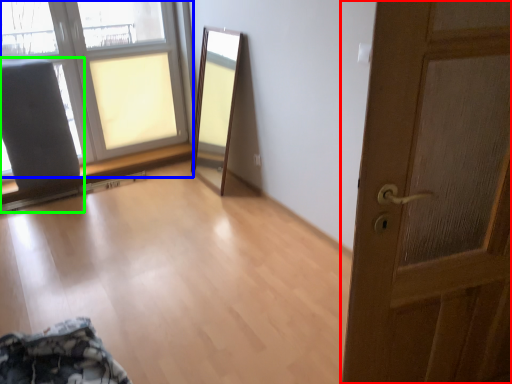
Question: Based on their relative distances, which object is nearer to door (highlighted by a red box)? Choose from window (highlighted by a blue box) and armchair (highlighted by a green box).

Choices:
 (A) window
 (B) armchair

Answer: (B)